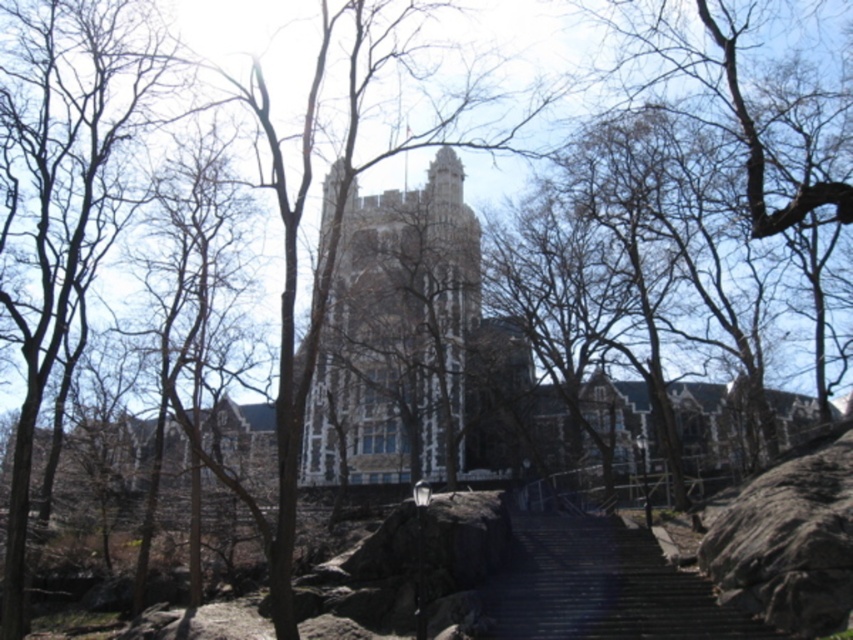
You are standing in front of the grand historic building and want to take a photo of the stone tower at center. Where should you position your camera to ensure the tower is centered in your shot?

To center the stone tower at center in your photo, position your camera so that its lens aligns with the coordinates point (395, 333), which is the 2D location of the stone tower at center.